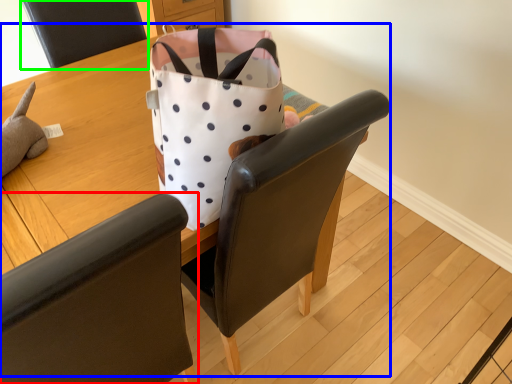
Question: Which object is positioned closest to chair (highlighted by a red box)? Select from table (highlighted by a blue box) and chair (highlighted by a green box).

Choices:
 (A) table
 (B) chair

Answer: (A)